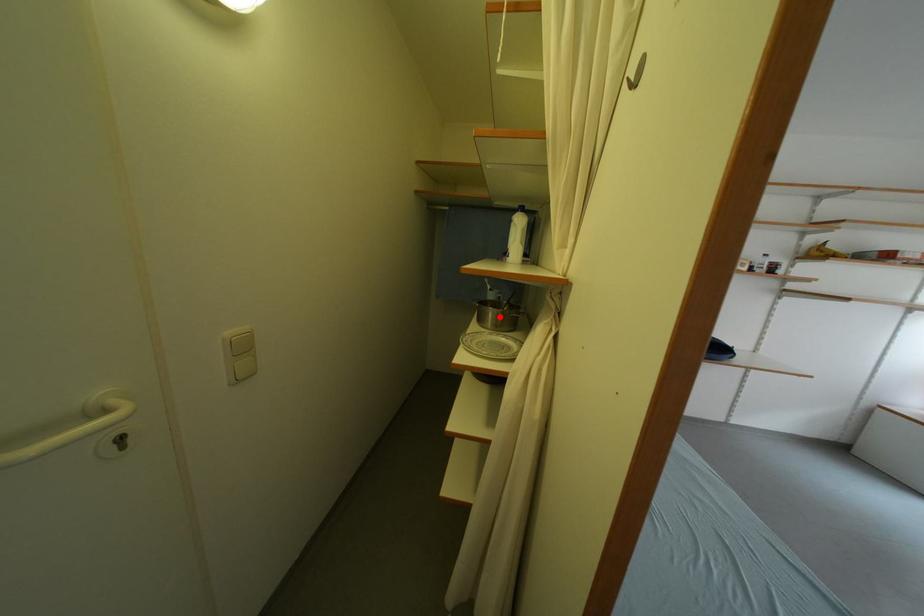
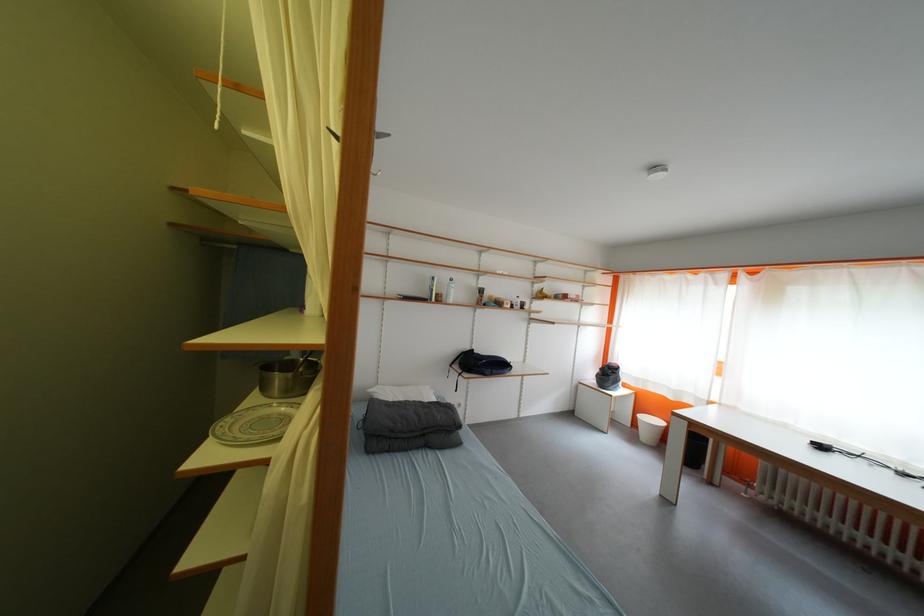
Locate, in the second image, the point that corresponds to the highlighted location in the first image.

(286, 382)